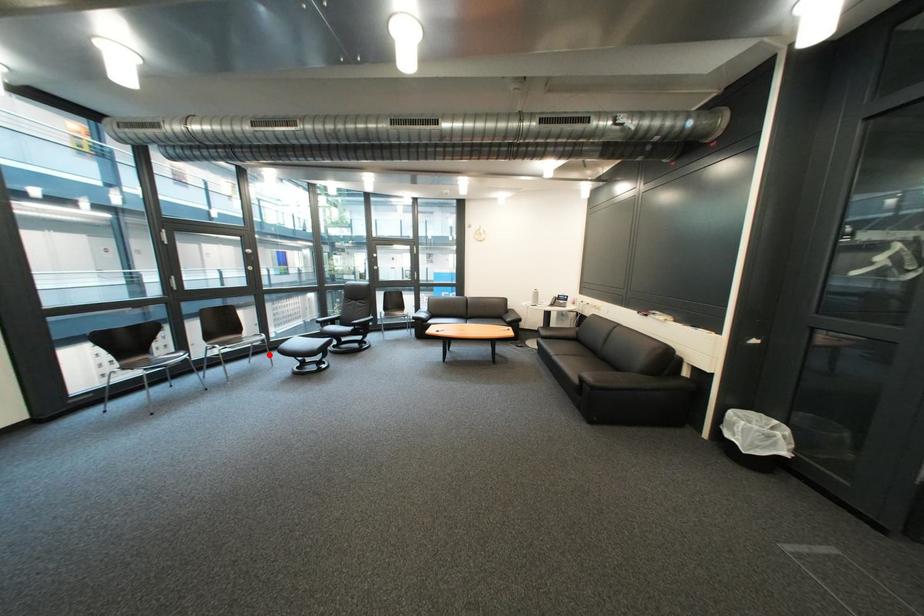
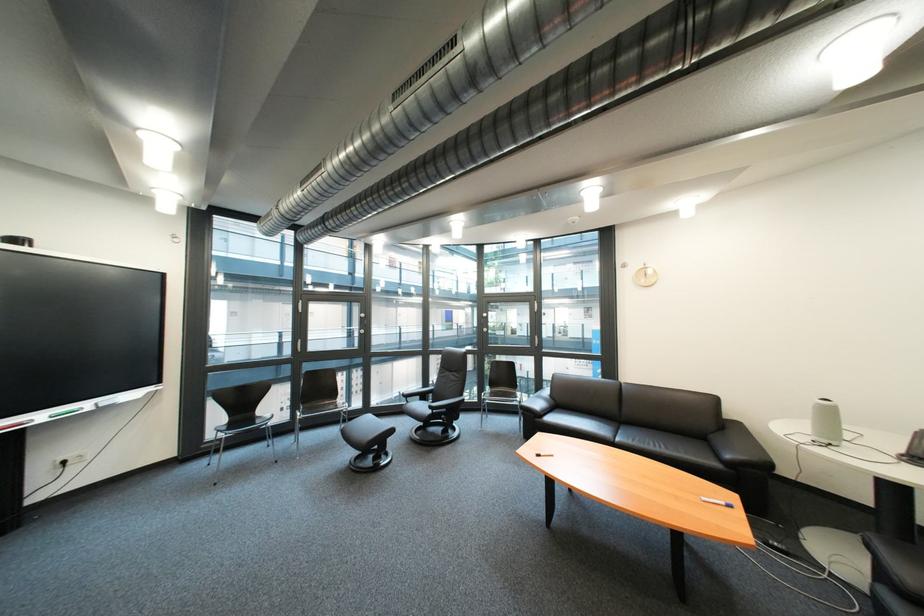
Question: I am providing you with two images of the same scene from different viewpoints. Image1 has a red point marked. In image2, the corresponding 3D location appears at what relative position? Reply with the corresponding letter.

Choices:
 (A) Closer
 (B) Farther

Answer: (A)